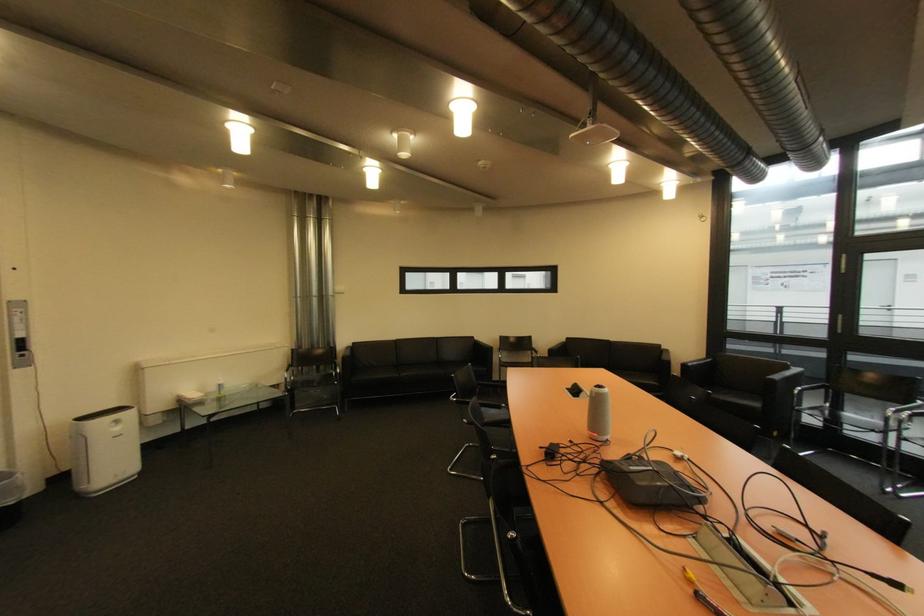
Where is `vertical door handle`? This screenshot has height=616, width=924. vertical door handle is located at coordinates 844,353.